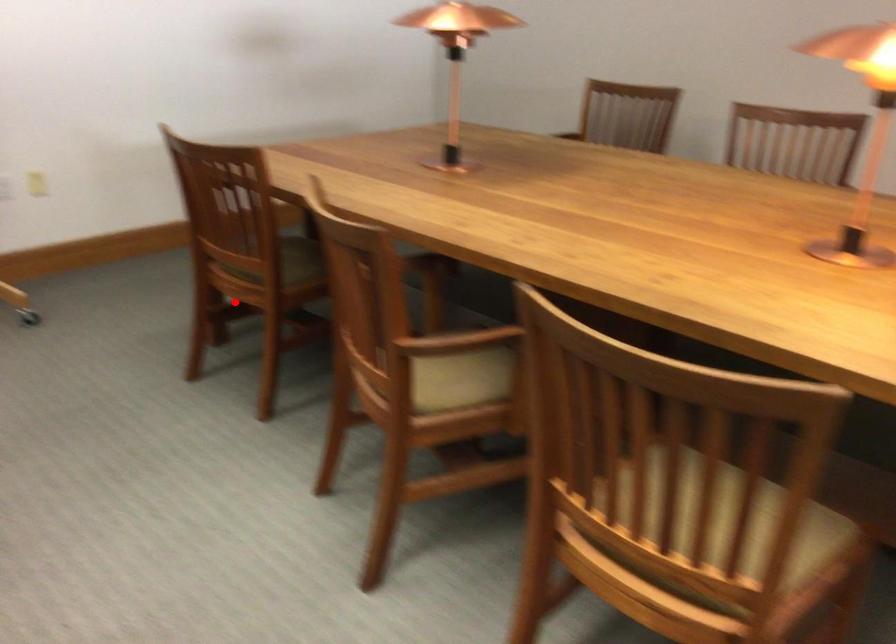
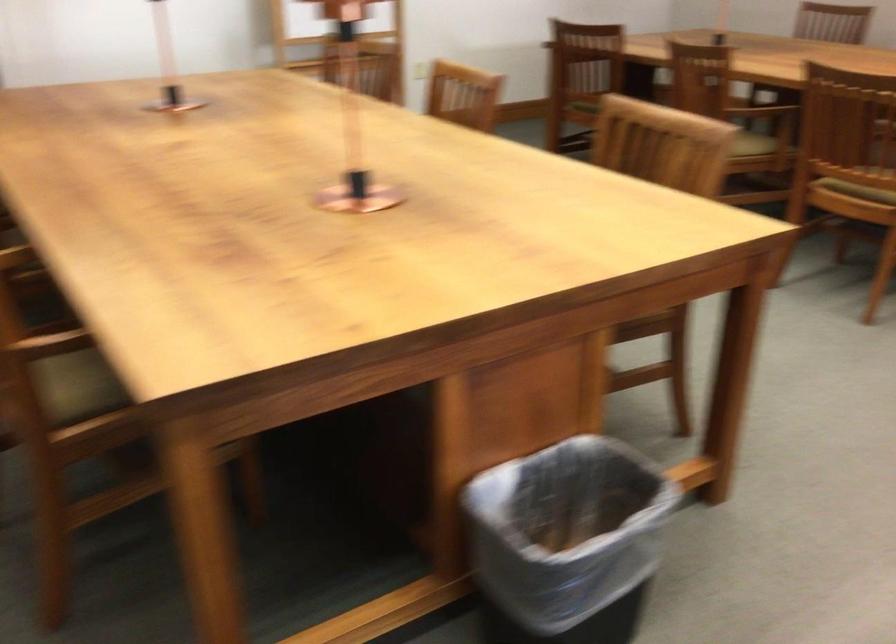
The point at the highlighted location is marked in the first image. Where is the corresponding point in the second image?

(583, 106)